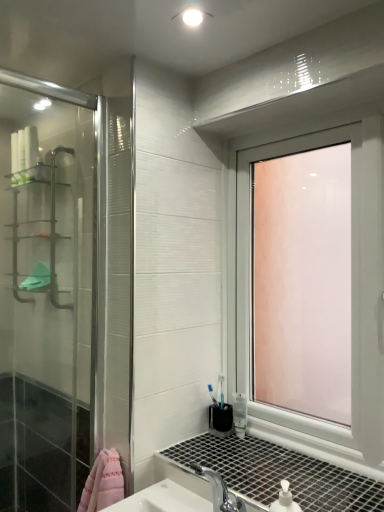
Find the location of a particular element. Image resolution: width=384 pixels, height=512 pixels. metallic silver shelf at left is located at coordinates (54, 230).

What do you see at coordinates (54, 230) in the screenshot?
I see `metallic silver shelf at left` at bounding box center [54, 230].

I want to click on transparent glass window at upper right, so click(x=251, y=233).

The image size is (384, 512). Describe the element at coordinates (251, 233) in the screenshot. I see `transparent glass window at upper right` at that location.

At what (x,y) coordinates should I click in order to perform the action: click on metallic silver shelf at left. Please return your answer as a coordinate pair (x, y). The width and height of the screenshot is (384, 512). Looking at the image, I should click on (54, 230).

Would you say transparent glass window at upper right is to the left or to the right of metallic silver shelf at left in the picture?

Clearly, transparent glass window at upper right is on the right of metallic silver shelf at left in the image.

Looking at this image, which object is more forward, transparent glass window at upper right or metallic silver shelf at left?

transparent glass window at upper right is in front.

Considering the positions of point (356, 298) and point (17, 234), is point (356, 298) closer or farther from the camera than point (17, 234)?

Point (356, 298) is positioned closer to the camera compared to point (17, 234).

From the image's perspective, is transparent glass window at upper right above metallic silver shelf at left?

No, from the image's perspective, transparent glass window at upper right is not on top of metallic silver shelf at left.

From a real-world perspective, which object stands above the other?

metallic silver shelf at left is physically above.

Is transparent glass window at upper right thinner than metallic silver shelf at left?

Yes, transparent glass window at upper right is thinner than metallic silver shelf at left.

From their relative heights in the image, would you say transparent glass window at upper right is taller or shorter than metallic silver shelf at left?

Clearly, transparent glass window at upper right is taller compared to metallic silver shelf at left.

Considering the sizes of objects transparent glass window at upper right and metallic silver shelf at left in the image provided, who is smaller, transparent glass window at upper right or metallic silver shelf at left?

With smaller size is metallic silver shelf at left.

Is transparent glass window at upper right situated inside metallic silver shelf at left or outside?

The correct answer is: outside.

Is transparent glass window at upper right touching metallic silver shelf at left?

No, transparent glass window at upper right is not with metallic silver shelf at left.

Could you tell me if transparent glass window at upper right is facing metallic silver shelf at left?

No, transparent glass window at upper right is not oriented towards metallic silver shelf at left.

Based on the photo, how different are the orientations of transparent glass window at upper right and metallic silver shelf at left in degrees?

The angular difference between transparent glass window at upper right and metallic silver shelf at left is 1.39 degrees.

I want to click on shelf behind the transparent glass window at upper right, so click(x=54, y=230).

Considering the positions of objects metallic silver shelf at left and transparent glass window at upper right in the image provided, who is more to the left, metallic silver shelf at left or transparent glass window at upper right?

metallic silver shelf at left is more to the left.

Relative to transparent glass window at upper right, is metallic silver shelf at left in front or behind?

Clearly, metallic silver shelf at left is behind transparent glass window at upper right.

Is point (54, 236) closer to viewer compared to point (246, 289)?

That is False.

From the image's perspective, which one is positioned higher, metallic silver shelf at left or transparent glass window at upper right?

metallic silver shelf at left appears higher in the image.

From a real-world perspective, who is located lower, metallic silver shelf at left or transparent glass window at upper right?

transparent glass window at upper right is physically lower.

Does metallic silver shelf at left have a greater width compared to transparent glass window at upper right?

Indeed, metallic silver shelf at left has a greater width compared to transparent glass window at upper right.

Can you confirm if metallic silver shelf at left is shorter than transparent glass window at upper right?

Correct, metallic silver shelf at left is not as tall as transparent glass window at upper right.

Is metallic silver shelf at left smaller than transparent glass window at upper right?

→ Indeed, metallic silver shelf at left has a smaller size compared to transparent glass window at upper right.

Is metallic silver shelf at left not within transparent glass window at upper right?

Yes, metallic silver shelf at left is located beyond the bounds of transparent glass window at upper right.

Consider the image. Is metallic silver shelf at left touching transparent glass window at upper right?

They are not placed beside each other.

Could you tell me if metallic silver shelf at left is facing transparent glass window at upper right?

No, metallic silver shelf at left is not turned towards transparent glass window at upper right.

How different are the orientations of metallic silver shelf at left and transparent glass window at upper right in degrees?

The facing directions of metallic silver shelf at left and transparent glass window at upper right are 1.39 degrees apart.

The image size is (384, 512). Find the location of `shelf above the transparent glass window at upper right (from a real-world perspective)`. shelf above the transparent glass window at upper right (from a real-world perspective) is located at coordinates (54, 230).

The height and width of the screenshot is (512, 384). I want to click on window in front of the metallic silver shelf at left, so click(251, 233).

In order to click on shelf on the left side of transparent glass window at upper right in this screenshot , I will do `click(54, 230)`.